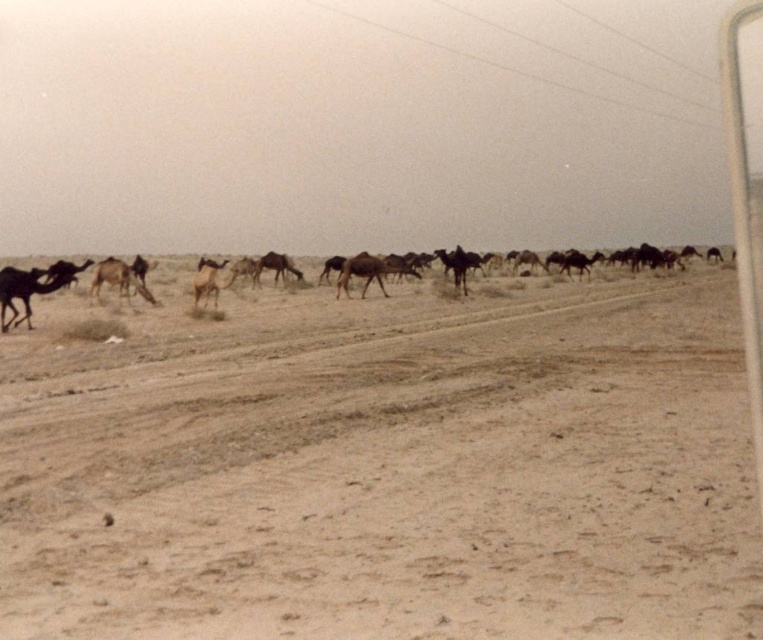
You are a traveler in the desert and need to cross the brown sandy dirt field at center. There is a brown matte camel at left nearby. Which one takes up more space in the image?

The brown sandy dirt field at center is larger in size than the brown matte camel at left, so the brown sandy dirt field at center takes up more space in the image.